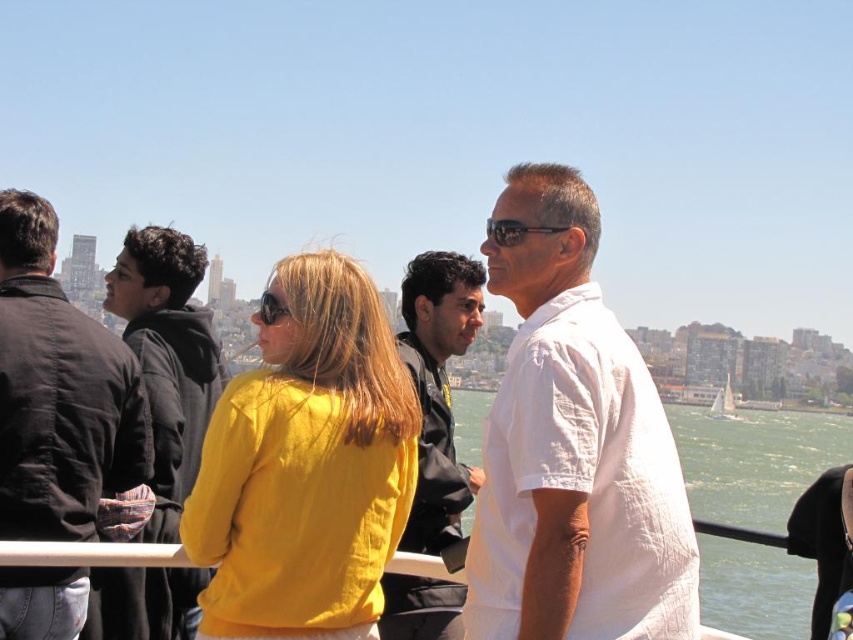
You are a photographer trying to capture a group photo of the people on the boat. You notice the white cotton shirt at center and the black leather jacket at center. Which person should you ask to stand on a lower step to ensure both are visible in the photo?

The white cotton shirt at center is much taller than the black leather jacket at center, so you should ask the person wearing the white cotton shirt at center to stand on a lower step to ensure both are visible in the photo.

You are on a boat and need to move from the dark brown leather jacket at left to the white sailboat at right. Which direction should you move?

You should move to the right because the dark brown leather jacket at left is to the left of the white sailboat at right.